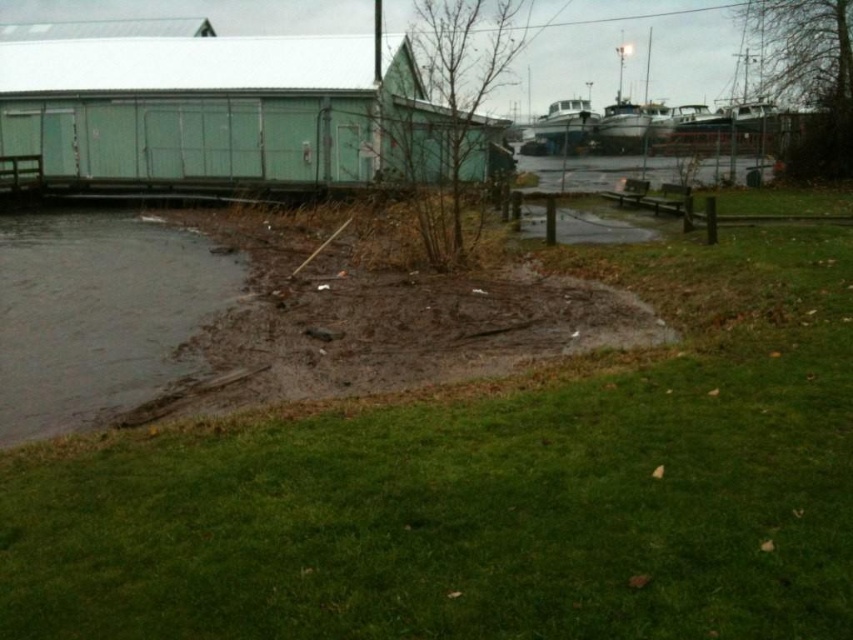
Is point (206, 96) positioned in front of point (357, 291)?

No, (206, 96) is behind (357, 291).

Who is more forward, (306, 100) or (508, 280)?

Positioned in front is point (508, 280).

The width and height of the screenshot is (853, 640). I want to click on green matte shed at upper left, so click(x=219, y=109).

Where is `green matte shed at upper left`? This screenshot has width=853, height=640. green matte shed at upper left is located at coordinates (219, 109).

Between green matte shed at upper left and dark gray mud at lower left, which one is positioned lower?

dark gray mud at lower left is below.

Can you confirm if green matte shed at upper left is shorter than dark gray mud at lower left?

No.

Which is behind, point (328, 115) or point (67, 310)?

The point (328, 115) is more distant.

This screenshot has width=853, height=640. Identify the location of green matte shed at upper left. (219, 109).

Which is above, muddy wet ground at lower center or clear water at center?

clear water at center

Image resolution: width=853 pixels, height=640 pixels. What do you see at coordinates (378, 317) in the screenshot? I see `muddy wet ground at lower center` at bounding box center [378, 317].

Which is behind, point (308, 272) or point (579, 164)?

The point (579, 164) is behind.

The height and width of the screenshot is (640, 853). What are the coordinates of `muddy wet ground at lower center` in the screenshot? It's located at (378, 317).